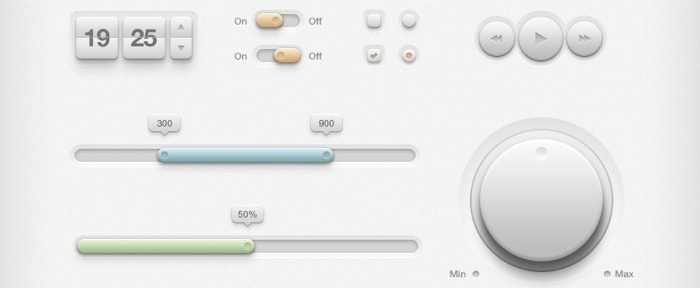
I want to click on off switch, so click(x=278, y=53).